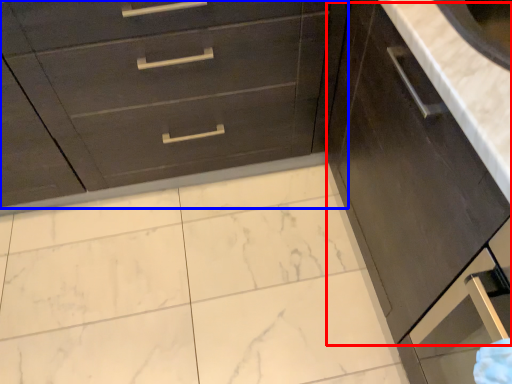
Question: Which object is further to the camera taking this photo, cabinetry (highlighted by a red box) or chest of drawers (highlighted by a blue box)?

Choices:
 (A) cabinetry
 (B) chest of drawers

Answer: (B)